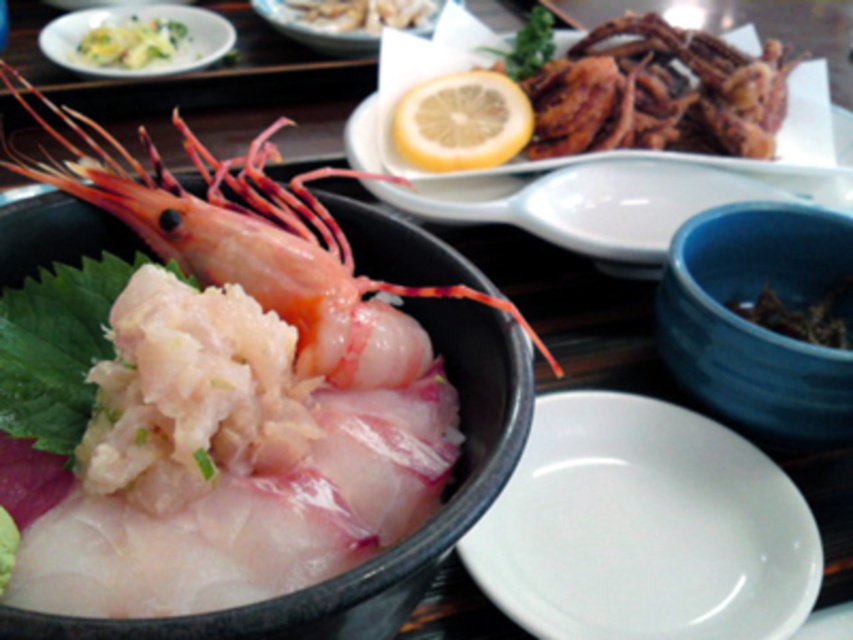
Does white glossy bowl at center have a larger size compared to yellow shredded salad at upper left?

Yes, white glossy bowl at center is bigger than yellow shredded salad at upper left.

Is point (134, 250) behind point (97, 54)?

No, (134, 250) is closer to viewer.

This screenshot has height=640, width=853. Describe the element at coordinates (399, 541) in the screenshot. I see `white glossy bowl at center` at that location.

At what (x,y) coordinates should I click in order to perform the action: click on white glossy bowl at center. Please return your answer as a coordinate pair (x, y). The width and height of the screenshot is (853, 640). Looking at the image, I should click on click(x=399, y=541).

Can you confirm if grilled squid at upper right is positioned to the right of yellow matte lemon at center?

Indeed, grilled squid at upper right is positioned on the right side of yellow matte lemon at center.

Between point (679, 141) and point (495, 83), which one is positioned in front?

Positioned in front is point (679, 141).

The height and width of the screenshot is (640, 853). Describe the element at coordinates (657, 93) in the screenshot. I see `grilled squid at upper right` at that location.

You are a GUI agent. You are given a task and a screenshot of the screen. Output one action in this format:
    pyautogui.click(x=<x>, y=<y>)
    Task: Click on the grilled squid at upper right
    This screenshot has width=853, height=640.
    Given the screenshot: What is the action you would take?
    pyautogui.click(x=657, y=93)

Who is lower down, yellow matte lemon at center or matte yellow lemon at upper center?

yellow matte lemon at center is below.

Does yellow matte lemon at center lie in front of matte yellow lemon at upper center?

Yes, yellow matte lemon at center is in front of matte yellow lemon at upper center.

This screenshot has width=853, height=640. Find the location of `yellow matte lemon at center`. yellow matte lemon at center is located at coordinates (462, 122).

The image size is (853, 640). I want to click on yellow matte lemon at center, so pos(462,122).